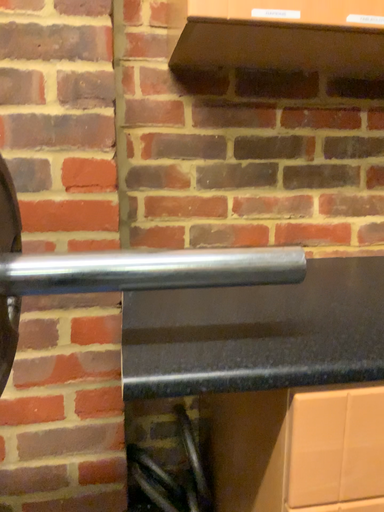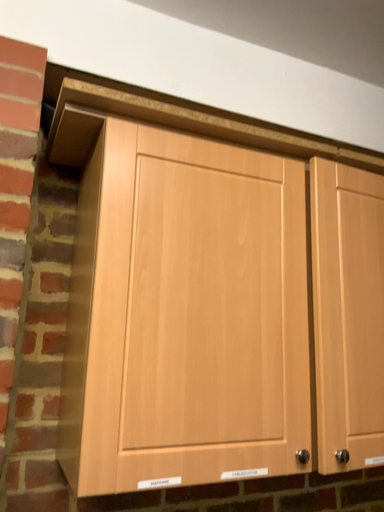
Question: Which way did the camera rotate in the video?

Choices:
 (A) rotated downward
 (B) rotated upward

Answer: (B)